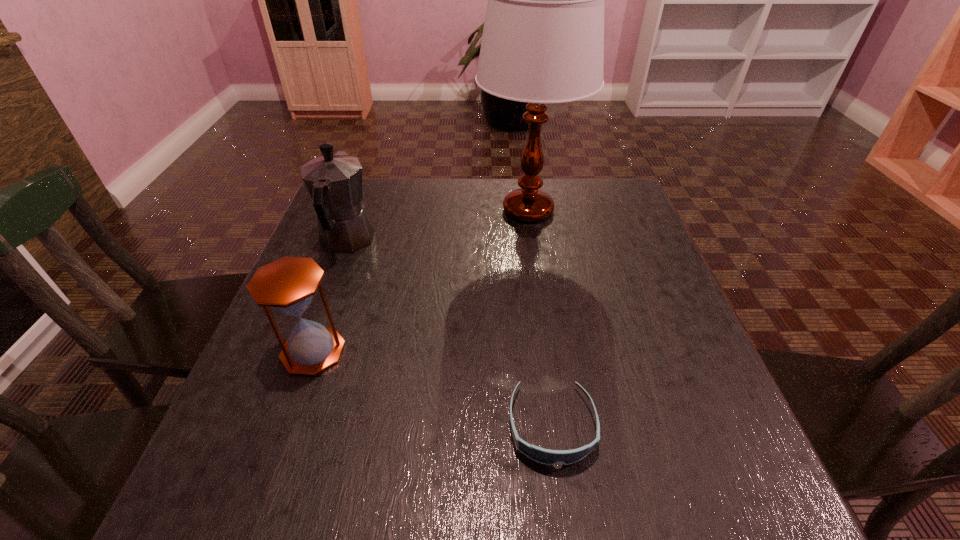
In the image, there is a desktop. At what (x,y) coordinates should I click in order to perform the action: click on free region at the far edge. Please return your answer as a coordinate pair (x, y). The width and height of the screenshot is (960, 540). Looking at the image, I should click on (561, 194).

Locate an element on the screen. free point at the near edge is located at coordinates (371, 489).

Image resolution: width=960 pixels, height=540 pixels. In the image, there is a desktop. Identify the location of vacant space at the left edge. (312, 231).

You are a GUI agent. You are given a task and a screenshot of the screen. Output one action in this format:
    pyautogui.click(x=<x>, y=<y>)
    Task: Click on the vacant space at the right edge of the desktop
    
    Given the screenshot: What is the action you would take?
    pyautogui.click(x=693, y=360)

Where is `vacant position at the far left corner of the desktop`? Image resolution: width=960 pixels, height=540 pixels. vacant position at the far left corner of the desktop is located at coordinates (367, 192).

You are a GUI agent. You are given a task and a screenshot of the screen. Output one action in this format:
    pyautogui.click(x=<x>, y=<y>)
    Task: Click on the free space at the near left corner of the desktop
    Image resolution: width=960 pixels, height=540 pixels.
    Given the screenshot: What is the action you would take?
    pyautogui.click(x=252, y=480)

Where is `vacant space at the far right corner of the desktop`? vacant space at the far right corner of the desktop is located at coordinates (587, 178).

Where is `empty location between the tallest object and the nearest object`? The height and width of the screenshot is (540, 960). empty location between the tallest object and the nearest object is located at coordinates [540, 318].

The image size is (960, 540). Find the location of `free area in between the hourglass and the shortest object`. free area in between the hourglass and the shortest object is located at coordinates (433, 389).

Where is `vacant area between the nearest object and the tallest object`? This screenshot has width=960, height=540. vacant area between the nearest object and the tallest object is located at coordinates (540, 318).